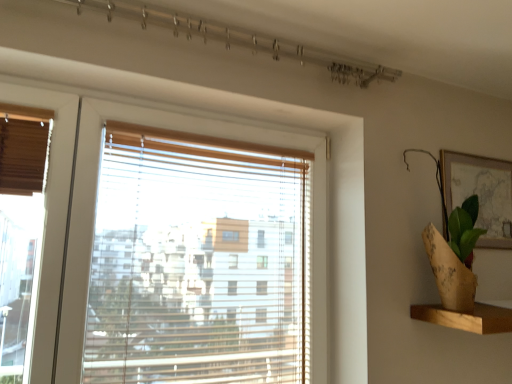
Question: Can you confirm if wooden at right is wider than matte gold picture frame at upper right?

Choices:
 (A) no
 (B) yes

Answer: (B)

Question: Is wooden at right positioned before matte gold picture frame at upper right?

Choices:
 (A) no
 (B) yes

Answer: (B)

Question: From the image's perspective, is wooden at right over matte gold picture frame at upper right?

Choices:
 (A) no
 (B) yes

Answer: (A)

Question: Does wooden at right appear on the right side of matte gold picture frame at upper right?

Choices:
 (A) no
 (B) yes

Answer: (A)

Question: Is wooden at right not near matte gold picture frame at upper right?

Choices:
 (A) yes
 (B) no

Answer: (B)

Question: Is matte gold picture frame at upper right inside wooden at right?

Choices:
 (A) yes
 (B) no

Answer: (B)

Question: Considering the relative sizes of burlap wrapped plant at right and wooden at right in the image provided, is burlap wrapped plant at right wider than wooden at right?

Choices:
 (A) yes
 (B) no

Answer: (B)

Question: Is wooden at right surrounded by burlap wrapped plant at right?

Choices:
 (A) yes
 (B) no

Answer: (B)

Question: From the image's perspective, is burlap wrapped plant at right on top of wooden at right?

Choices:
 (A) yes
 (B) no

Answer: (A)

Question: Is burlap wrapped plant at right positioned before wooden at right?

Choices:
 (A) no
 (B) yes

Answer: (B)

Question: Does burlap wrapped plant at right touch wooden at right?

Choices:
 (A) no
 (B) yes

Answer: (A)

Question: From a real-world perspective, is burlap wrapped plant at right below wooden at right?

Choices:
 (A) no
 (B) yes

Answer: (A)

Question: Can you confirm if burlap wrapped plant at right is taller than matte gold picture frame at upper right?

Choices:
 (A) yes
 (B) no

Answer: (A)